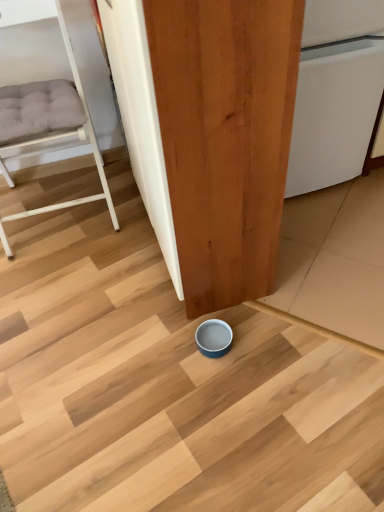
From the picture: What is the approximate width of matte wood door at center?

matte wood door at center is 13.66 inches wide.

Find the location of a particular element. Image resolution: width=384 pixels, height=512 pixels. white glossy dishwasher at center is located at coordinates (336, 92).

What do you see at coordinates (336, 92) in the screenshot?
I see `white glossy dishwasher at center` at bounding box center [336, 92].

From the picture: In order to face white matte bunk bed at left, should I rotate leftwards or rightwards?

You should rotate left by 20.888 degrees.

This screenshot has height=512, width=384. What are the coordinates of `matte wood door at center` in the screenshot? It's located at (225, 137).

Would you consider white matte bunk bed at left to be distant from matte wood door at center?

white matte bunk bed at left is near matte wood door at center, not far away.

Who is more distant, white matte bunk bed at left or matte wood door at center?

white matte bunk bed at left is further away from the camera.

Which is nearer, (26, 212) or (191, 131)?

The point (191, 131) is in front.

Considering the sizes of objects white matte bunk bed at left and matte wood door at center in the image provided, who is taller, white matte bunk bed at left or matte wood door at center?

matte wood door at center.

Is white glossy dishwasher at center placed right next to white matte bunk bed at left?

white glossy dishwasher at center is not next to white matte bunk bed at left, and they're not touching.

Considering the points (365, 13) and (92, 136), which point is in front, point (365, 13) or point (92, 136)?

The point (365, 13) is closer to the camera.

From a real-world perspective, relative to white matte bunk bed at left, is white glossy dishwasher at center vertically above or below?

Clearly, from a real-world perspective, white glossy dishwasher at center is below white matte bunk bed at left.

You are a GUI agent. You are given a task and a screenshot of the screen. Output one action in this format:
    pyautogui.click(x=<x>, y=<y>)
    Task: Click on the furniture that appears behind the matte wood door at center
    
    Given the screenshot: What is the action you would take?
    pyautogui.click(x=53, y=128)

From the image's perspective, between matte wood door at center and white matte bunk bed at left, who is located below?

From the image's view, matte wood door at center is below.

Does matte wood door at center lie behind white matte bunk bed at left?

No, it is not.

Is matte wood door at center directly adjacent to white glossy dishwasher at center?

No, matte wood door at center is not making contact with white glossy dishwasher at center.

Considering the sizes of objects matte wood door at center and white glossy dishwasher at center in the image provided, who is bigger, matte wood door at center or white glossy dishwasher at center?

Bigger between the two is matte wood door at center.

From their relative heights in the image, would you say matte wood door at center is taller or shorter than white glossy dishwasher at center?

matte wood door at center is taller than white glossy dishwasher at center.

Does matte wood door at center appear on the left side of white glossy dishwasher at center?

Yes, matte wood door at center is to the left of white glossy dishwasher at center.

Is white glossy dishwasher at center at the back of white matte bunk bed at left?

No, white matte bunk bed at left is not facing away from white glossy dishwasher at center.

Looking at this image, can you confirm if white matte bunk bed at left is bigger than white glossy dishwasher at center?

Correct, white matte bunk bed at left is larger in size than white glossy dishwasher at center.

Which is more to the right, white matte bunk bed at left or white glossy dishwasher at center?

white glossy dishwasher at center is more to the right.

Which of these two, white glossy dishwasher at center or matte wood door at center, is thinner?

matte wood door at center is thinner.

From a real-world perspective, does white glossy dishwasher at center sit lower than matte wood door at center?

Yes.

Is white glossy dishwasher at center shorter than matte wood door at center?

Indeed, white glossy dishwasher at center has a lesser height compared to matte wood door at center.

Is matte wood door at center at the back of white glossy dishwasher at center?

white glossy dishwasher at center is not turned away from matte wood door at center.

Find the location of a particular element. furniture that is behind the matte wood door at center is located at coordinates (53, 128).

This screenshot has width=384, height=512. In order to click on dish washer on the right of white matte bunk bed at left in this screenshot , I will do `click(336, 92)`.

Estimate the real-world distances between objects in this image. Which object is closer to white glossy dishwasher at center, matte wood door at center or white matte bunk bed at left?

The object closer to white glossy dishwasher at center is matte wood door at center.

When comparing their distances from white matte bunk bed at left, does white glossy dishwasher at center or matte wood door at center seem further?

white glossy dishwasher at center.

Which object lies nearer to the anchor point matte wood door at center, white matte bunk bed at left or white glossy dishwasher at center?

white glossy dishwasher at center is positioned closer to the anchor matte wood door at center.

Which object lies further to the anchor point white glossy dishwasher at center, white matte bunk bed at left or matte wood door at center?

white matte bunk bed at left is further to white glossy dishwasher at center.

Looking at this image, looking at the image, which one is located further to white matte bunk bed at left, matte wood door at center or white glossy dishwasher at center?

white glossy dishwasher at center lies further to white matte bunk bed at left than the other object.

From the image, which object appears to be nearer to matte wood door at center, white glossy dishwasher at center or white matte bunk bed at left?

The object closer to matte wood door at center is white glossy dishwasher at center.

You are a GUI agent. You are given a task and a screenshot of the screen. Output one action in this format:
    pyautogui.click(x=<x>, y=<y>)
    Task: Click on the plywood situated between white matte bunk bed at left and white glossy dishwasher at center from left to right
    The height and width of the screenshot is (512, 384).
    Given the screenshot: What is the action you would take?
    [x=225, y=137]